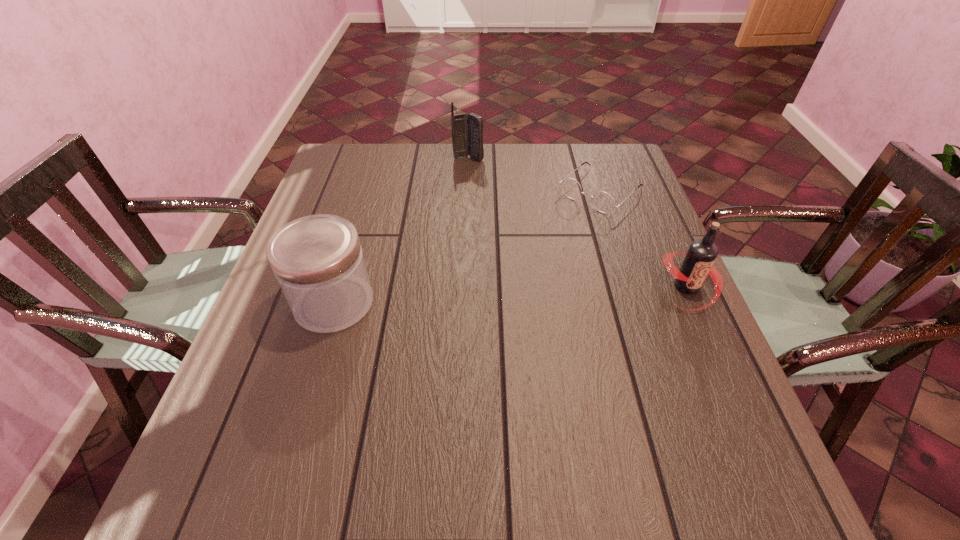
The height and width of the screenshot is (540, 960). Identify the location of free space located on the front-facing side of the shortest object. (538, 248).

The image size is (960, 540). I want to click on free space located 0.130m on the keyboard of the second object from left to right, so click(486, 186).

Identify the location of vacant space situated on the keyboard of the second object from left to right. (495, 201).

The image size is (960, 540). I want to click on vacant space located 0.050m on the keyboard of the second object from left to right, so click(x=478, y=171).

This screenshot has height=540, width=960. In order to click on spectacles positioned at the far edge in this screenshot , I will do `click(603, 201)`.

This screenshot has width=960, height=540. I want to click on cellular telephone at the far edge, so click(x=467, y=131).

The width and height of the screenshot is (960, 540). I want to click on object present at the left edge, so pos(318,262).

This screenshot has height=540, width=960. In order to click on root beer positioned at the right edge in this screenshot , I will do `click(698, 263)`.

I want to click on spectacles at the right edge, so click(x=603, y=201).

Find the location of a particular element. object present at the far right corner is located at coordinates (603, 201).